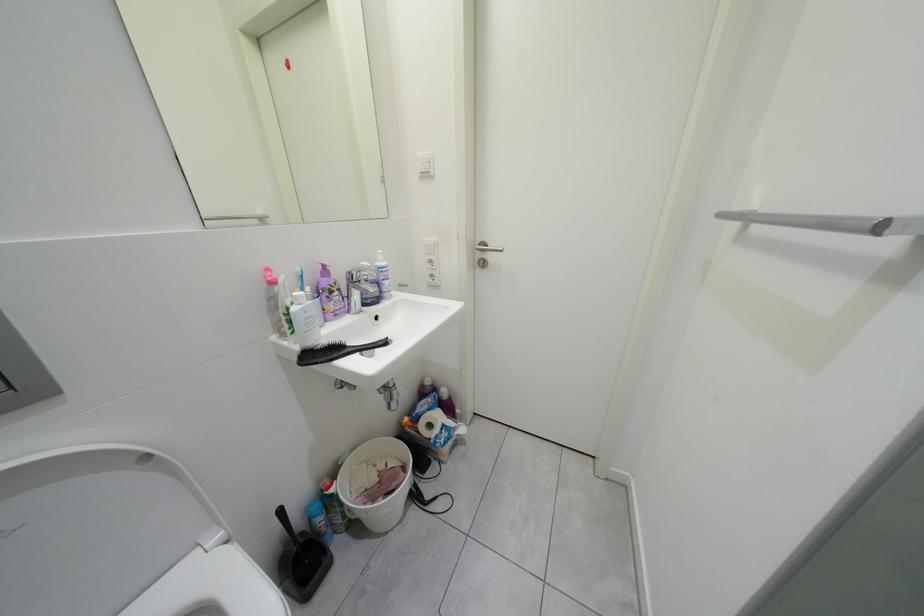
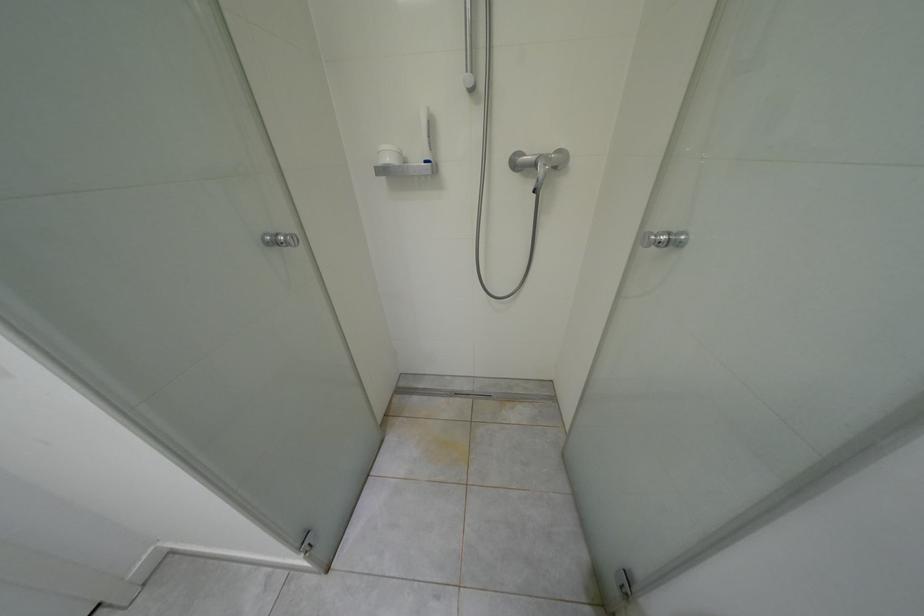
First-person continuous shooting, in which direction is the camera rotating?

The camera rotated toward right-down.